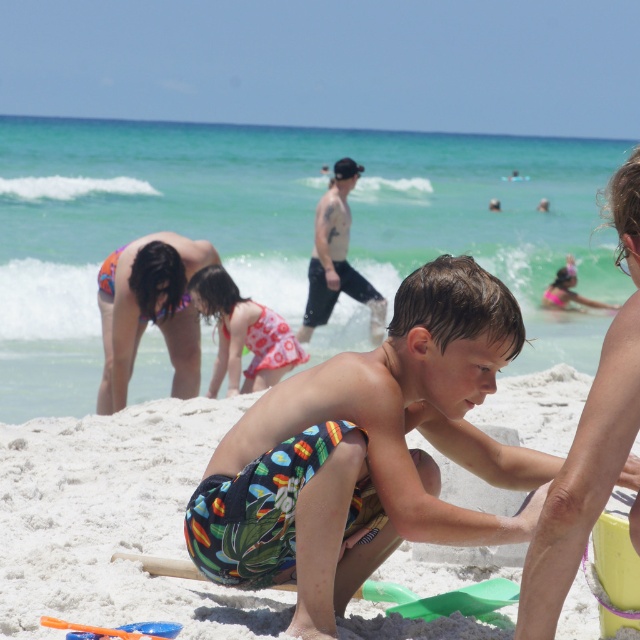
The width and height of the screenshot is (640, 640). What do you see at coordinates (368, 452) in the screenshot? I see `printed fabric shorts at center` at bounding box center [368, 452].

Can you confirm if printed fabric shorts at center is smaller than printed bikini at lower left?

Incorrect, printed fabric shorts at center is not smaller in size than printed bikini at lower left.

I want to click on printed fabric shorts at center, so click(368, 452).

What are the coordinates of `printed fabric shorts at center` in the screenshot? It's located at (368, 452).

Which is more to the left, printed fabric shorts at center or skinny white man at center?

skinny white man at center is more to the left.

Which is behind, point (289, 560) or point (314, 269)?

The point (314, 269) is behind.

I want to click on printed fabric shorts at center, so click(368, 452).

Does printed bikini at lower left appear over pink dotted swimsuit at center?

Correct, printed bikini at lower left is located above pink dotted swimsuit at center.

Between printed bikini at lower left and pink dotted swimsuit at center, which one appears on the left side from the viewer's perspective?

printed bikini at lower left is more to the left.

I want to click on printed bikini at lower left, so click(x=148, y=310).

Locate an element on the screen. printed bikini at lower left is located at coordinates (148, 310).